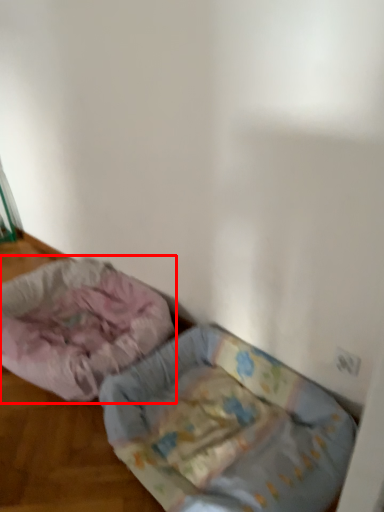
Question: From the image's perspective, where is dog bed (annotated by the red box) located relative to dog bed?

Choices:
 (A) above
 (B) below

Answer: (A)